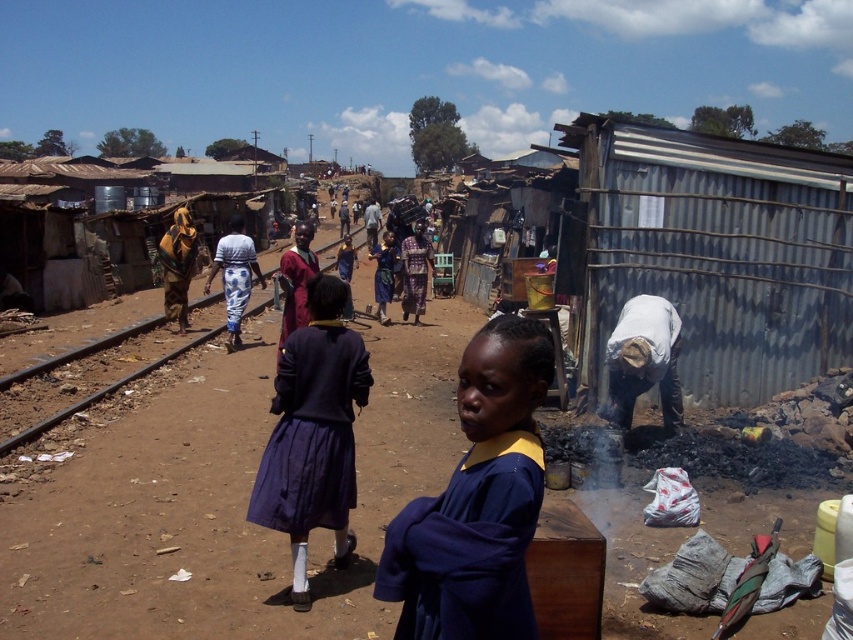
Which is behind, point (242, 308) or point (280, 337)?

The point (242, 308) is behind.

Which is above, blue printed dress at center or maroon fabric dress at center?

blue printed dress at center is higher up.

Which is behind, point (225, 301) or point (296, 241)?

Point (225, 301)

Find the location of a particular element. blue printed dress at center is located at coordinates (234, 276).

Can you confirm if matte brown dress at left is positioned to the left of patterned fabric dress at center?

Yes, matte brown dress at left is to the left of patterned fabric dress at center.

Is point (177, 232) farther from viewer compared to point (422, 292)?

No, (177, 232) is in front of (422, 292).

Does point (184, 284) come behind point (404, 305)?

No, (184, 284) is closer to viewer.

Where is `matte brown dress at left`? The image size is (853, 640). matte brown dress at left is located at coordinates (177, 266).

Does maroon fabric dress at center have a smaller size compared to patterned fabric dress at center?

No, maroon fabric dress at center is not smaller than patterned fabric dress at center.

Which is more to the right, maroon fabric dress at center or patterned fabric dress at center?

From the viewer's perspective, patterned fabric dress at center appears more on the right side.

Is point (286, 288) less distant than point (421, 248)?

Yes, it is.

At what (x,y) coordinates should I click in order to perform the action: click on maroon fabric dress at center. Please return your answer as a coordinate pair (x, y). The image size is (853, 640). Looking at the image, I should click on (296, 280).